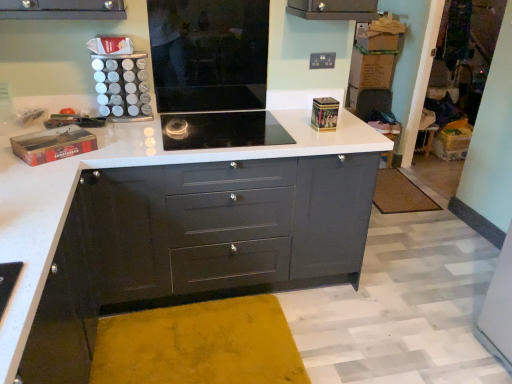
Question: From the image's perspective, is brown textured mat at lower right over matte black chest of drawers at center?

Choices:
 (A) no
 (B) yes

Answer: (B)

Question: Can you confirm if brown textured mat at lower right is taller than matte black chest of drawers at center?

Choices:
 (A) no
 (B) yes

Answer: (A)

Question: Does brown textured mat at lower right have a lesser width compared to matte black chest of drawers at center?

Choices:
 (A) yes
 (B) no

Answer: (A)

Question: Is brown textured mat at lower right completely or partially outside of matte black chest of drawers at center?

Choices:
 (A) no
 (B) yes

Answer: (B)

Question: Is the position of brown textured mat at lower right more distant than that of matte black chest of drawers at center?

Choices:
 (A) yes
 (B) no

Answer: (A)

Question: From a real-world perspective, is brown textured mat at lower right under matte black chest of drawers at center?

Choices:
 (A) yes
 (B) no

Answer: (A)

Question: Can you confirm if brown textured mat at lower right is positioned to the right of black glass cooktop at center?

Choices:
 (A) no
 (B) yes

Answer: (B)

Question: Does brown textured mat at lower right come in front of black glass cooktop at center?

Choices:
 (A) no
 (B) yes

Answer: (A)

Question: From the image's perspective, is brown textured mat at lower right over black glass cooktop at center?

Choices:
 (A) no
 (B) yes

Answer: (A)

Question: From the image's perspective, is brown textured mat at lower right located beneath black glass cooktop at center?

Choices:
 (A) no
 (B) yes

Answer: (B)

Question: Is brown textured mat at lower right completely or partially outside of black glass cooktop at center?

Choices:
 (A) no
 (B) yes

Answer: (B)

Question: Is brown textured mat at lower right at the left side of black glass cooktop at center?

Choices:
 (A) yes
 (B) no

Answer: (B)

Question: From a real-world perspective, is black glass cooktop at center physically below brown textured mat at lower right?

Choices:
 (A) yes
 (B) no

Answer: (B)